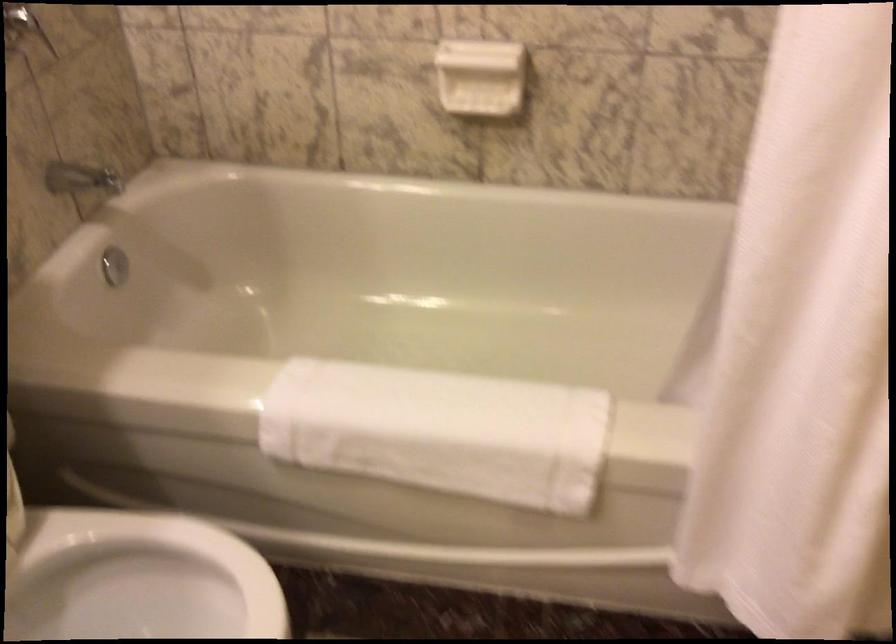
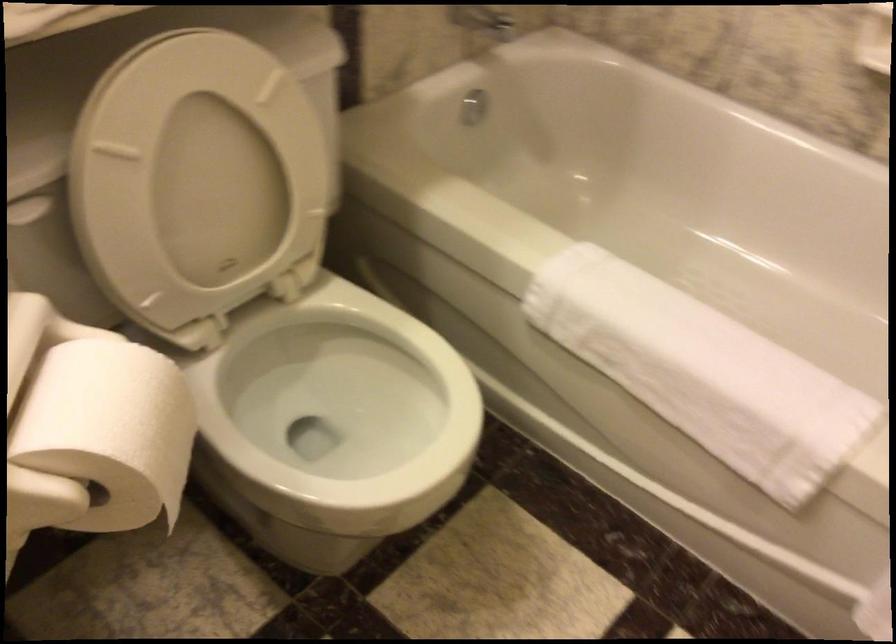
Question: The camera is either moving clockwise (left) or counter-clockwise (right) around the object. The first image is from the beginning of the video and the second image is from the end. Is the camera moving left or right when shooting the video?

Choices:
 (A) Left
 (B) Right

Answer: (B)